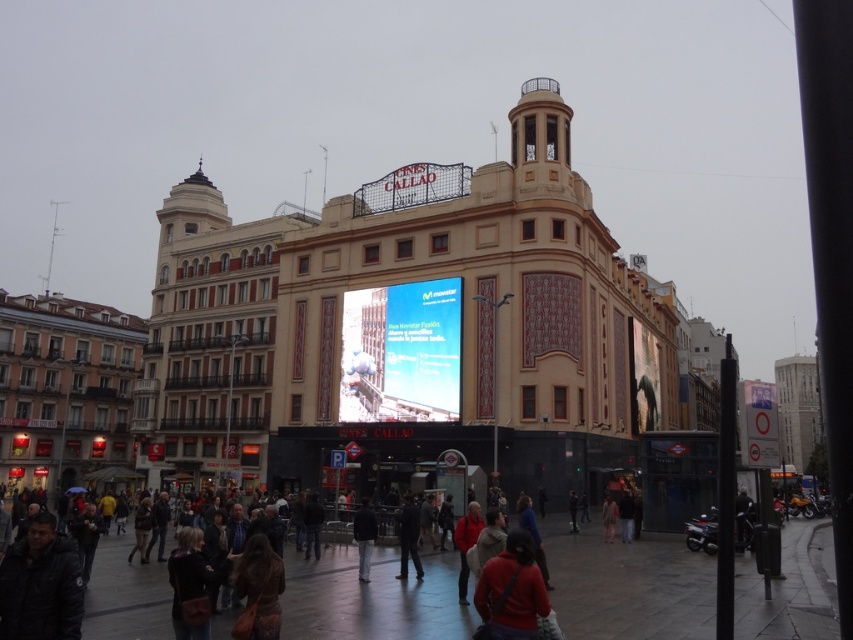
Question: Where is red sweater at center located in relation to dark blue jacket at center in the image?

Choices:
 (A) below
 (B) above

Answer: (B)

Question: From the image, what is the correct spatial relationship of dark blue jacket at center in relation to black matte jacket at center?

Choices:
 (A) left
 (B) right

Answer: (B)

Question: Which is farther from the blue glossy screen at center?

Choices:
 (A) black matte jacket at center
 (B) dark blue jacket at center
 (C) red sweater at center

Answer: (C)

Question: Which point is closer to the camera?

Choices:
 (A) leather brown bag at lower left
 (B) dark gray jacket at lower left
 (C) white plastic sign at lower right

Answer: (B)

Question: Can you confirm if dark blue jacket at center is thinner than red jacket at center?

Choices:
 (A) yes
 (B) no

Answer: (B)

Question: Which of the following is the farthest from the observer?

Choices:
 (A) (511, 531)
 (B) (413, 346)
 (C) (753, 445)

Answer: (B)